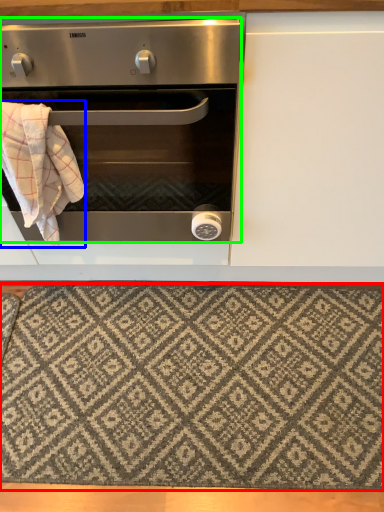
Question: Which object is the farthest from mat (highlighted by a red box)? Choose among these: blanket (highlighted by a blue box) or oven (highlighted by a green box).

Choices:
 (A) blanket
 (B) oven

Answer: (A)